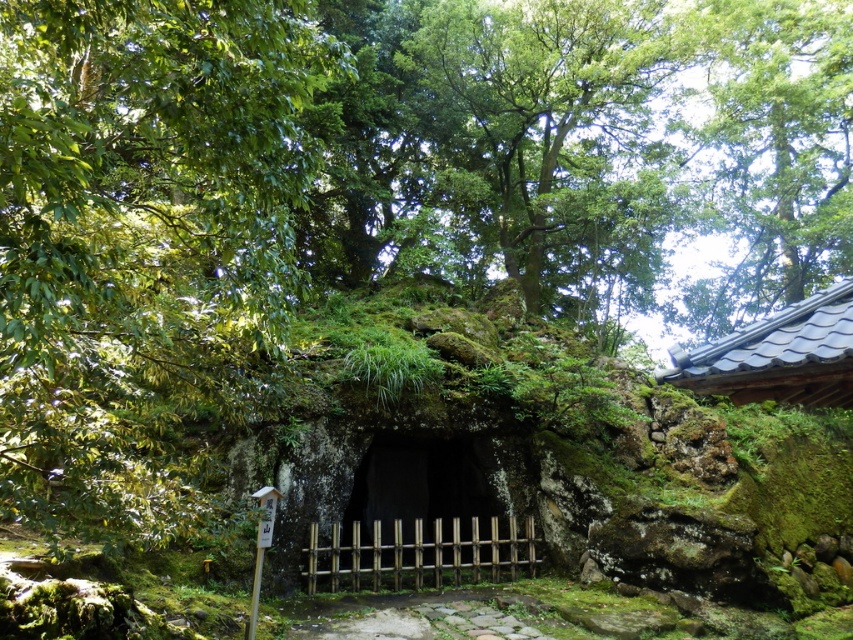
Locate an element on the screen. The width and height of the screenshot is (853, 640). green mossy tree at upper center is located at coordinates (553, 140).

Is point (665, 221) farther from viewer compared to point (808, 387)?

Yes, point (665, 221) is farther from viewer.

Where is `green mossy tree at upper center`? This screenshot has height=640, width=853. green mossy tree at upper center is located at coordinates (553, 140).

Consider the image. Is green leafy tree at upper left positioned in front of green leafy tree at upper right?

Yes, green leafy tree at upper left is in front of green leafy tree at upper right.

Is point (245, 308) farther from camera compared to point (743, 125)?

No, (245, 308) is in front of (743, 125).

Identify the location of green leafy tree at upper left. (143, 246).

Based on the photo, who is positioned more to the right, green leafy tree at upper left or dark brown wooden gate at center?

From the viewer's perspective, dark brown wooden gate at center appears more on the right side.

Is green leafy tree at upper left closer to camera compared to dark brown wooden gate at center?

Yes, green leafy tree at upper left is closer to the viewer.

Identify the location of green leafy tree at upper left. Image resolution: width=853 pixels, height=640 pixels. (143, 246).